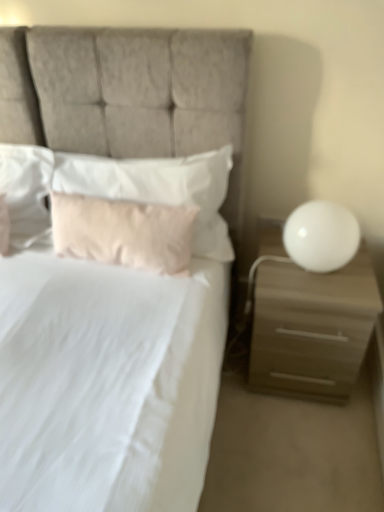
Question: From their relative heights in the image, would you say pink fabric pillow at center, which is the 2th pillow in left-to-right order, is taller or shorter than matte beige nightstand at right?

Choices:
 (A) tall
 (B) short

Answer: (B)

Question: In terms of width, does pink fabric pillow at center, acting as the second pillow starting from the right, look wider or thinner when compared to matte beige nightstand at right?

Choices:
 (A) thin
 (B) wide

Answer: (A)

Question: Which object is the closest to the matte beige nightstand at right?

Choices:
 (A) white soft pillow at upper left, placed as the first pillow when sorted from left to right
 (B) pink fabric pillow at center, which is the 2th pillow in left-to-right order
 (C) white glossy sphere at right
 (D) soft pink pillow at center, which is the 3th pillow in left-to-right order

Answer: (C)

Question: Based on their relative distances, which object is nearer to the soft pink pillow at center, arranged as the 1th pillow when viewed from the right?

Choices:
 (A) matte beige nightstand at right
 (B) pink fabric pillow at center, acting as the second pillow starting from the right
 (C) white glossy sphere at right
 (D) white soft pillow at upper left, which is the 3th pillow from right to left

Answer: (B)